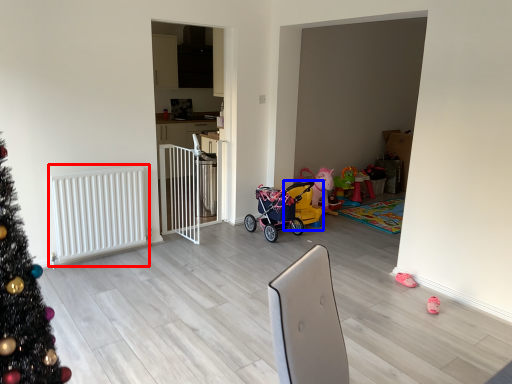
Question: Which point is further to the camera, radiator (highlighted by a red box) or baby carriage (highlighted by a blue box)?

Choices:
 (A) radiator
 (B) baby carriage

Answer: (B)